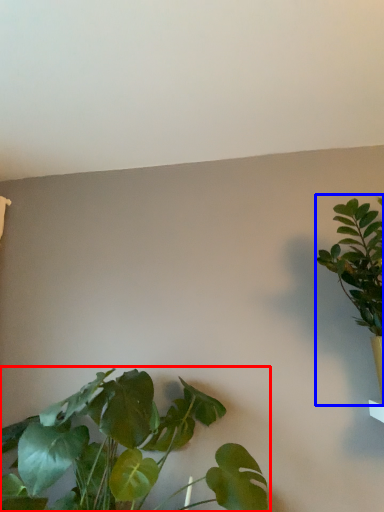
Question: Which point is closer to the camera, houseplant (highlighted by a red box) or houseplant (highlighted by a blue box)?

Choices:
 (A) houseplant
 (B) houseplant

Answer: (A)